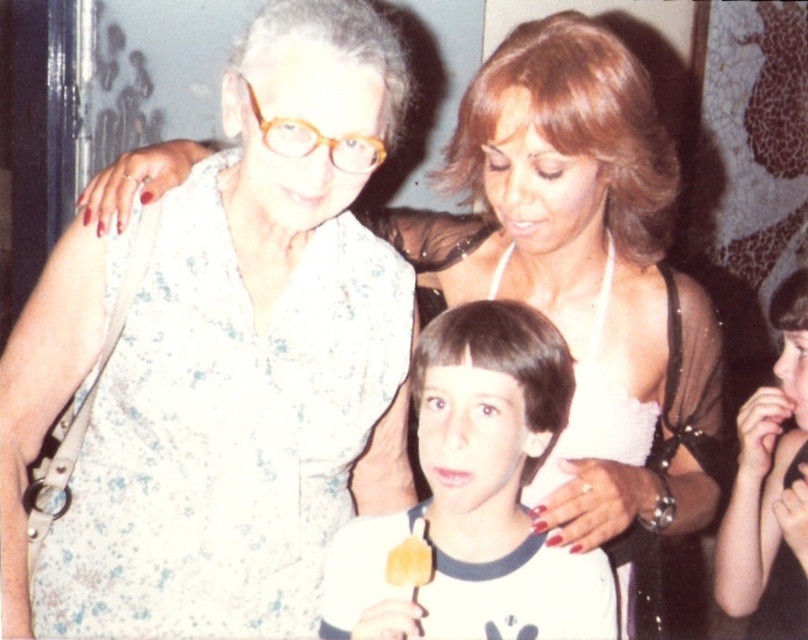
You are a photographer trying to capture a candid shot of the two people at the center of the image. The floral fabric blouse at center and the smooth white shirt at center are both in your frame. Which one is positioned to the left of the other?

The floral fabric blouse at center is to the left of the smooth white shirt at center.

You are a photographer trying to capture a closeup of the smooth white shirt at center and the smooth black hair at center. Which object should you zoom in on first to ensure it fits within the frame before adjusting for the other?

The smooth white shirt at center has a smaller size compared to the smooth black hair at center, so you should zoom in on the smooth white shirt at center first to ensure it fits within the frame before adjusting for the other.